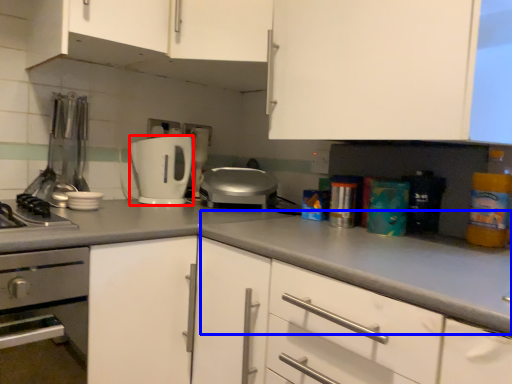
Question: Which of the following is the closest to the observer, toaster (highlighted by a red box) or counter top (highlighted by a blue box)?

Choices:
 (A) toaster
 (B) counter top

Answer: (B)